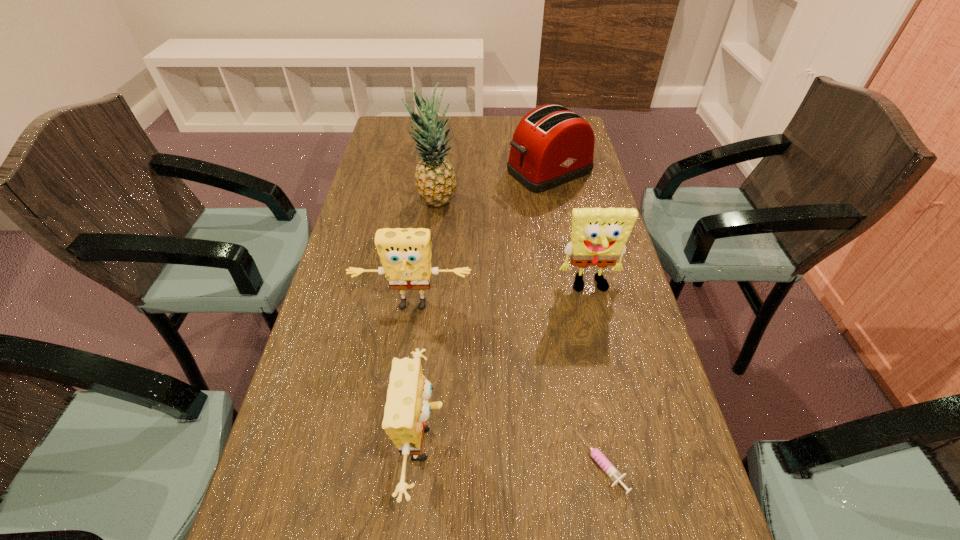
Locate an element on the screen. Image resolution: width=960 pixels, height=540 pixels. the tallest object is located at coordinates (435, 180).

Find the location of a particular element. This screenshot has width=960, height=540. the rightmost sponge is located at coordinates (599, 235).

Locate an element on the screen. The height and width of the screenshot is (540, 960). toaster is located at coordinates [x=551, y=145].

Find the location of a particular element. the nearest sponge is located at coordinates (407, 408).

What are the coordinates of `syringe` in the screenshot? It's located at (611, 471).

At what (x,y) coordinates should I click in order to perform the action: click on vacant space located 0.100m on the right of the pineapple. Please return your answer as a coordinate pair (x, y). This screenshot has height=540, width=960. Looking at the image, I should click on coord(491,202).

Where is `free point located 0.180m on the face of the rightmost sponge`? The height and width of the screenshot is (540, 960). free point located 0.180m on the face of the rightmost sponge is located at coordinates (608, 361).

The image size is (960, 540). I want to click on free space located on the front of the toaster, so click(560, 220).

Locate an element on the screen. The height and width of the screenshot is (540, 960). free space located on the face of the nearest sponge is located at coordinates (480, 444).

The image size is (960, 540). Find the location of `vacant space located on the back of the syringe`. vacant space located on the back of the syringe is located at coordinates (569, 299).